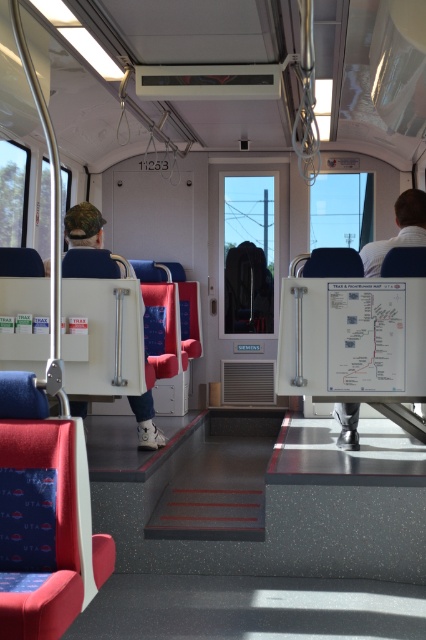
Which is behind, point (353, 426) or point (89, 212)?

The point (353, 426) is behind.

Does white fabric shirt at right have a lesser height compared to matte white cap at left?

No.

Describe the element at coordinates (399, 230) in the screenshot. I see `white fabric shirt at right` at that location.

The width and height of the screenshot is (426, 640). Find the location of `white fabric shirt at right`. white fabric shirt at right is located at coordinates (399, 230).